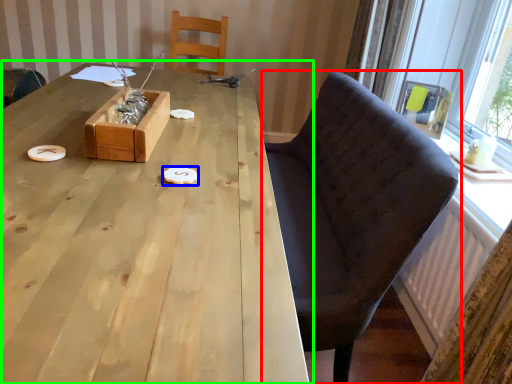
Question: Which object is the closest to the chair (highlighted by a red box)? Choose among these: food (highlighted by a blue box) or table (highlighted by a green box).

Choices:
 (A) food
 (B) table

Answer: (B)